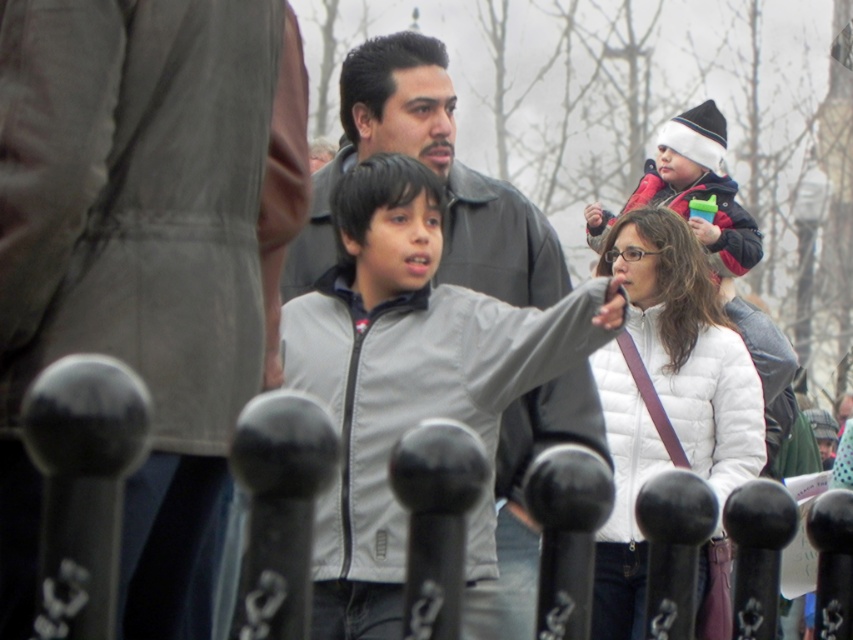
You are standing at the point marked as point [83,486] in the image. What object is located exactly at that point?

The black metal fence at center is located exactly at point [83,486].

You are a photographer trying to capture a clear shot of both the gray fabric jacket at center and the red fleece jacket at upper right. Given their heights, which jacket will appear larger in your photo?

The gray fabric jacket at center appears larger in the photo because it has a greater height compared to the red fleece jacket at upper right.